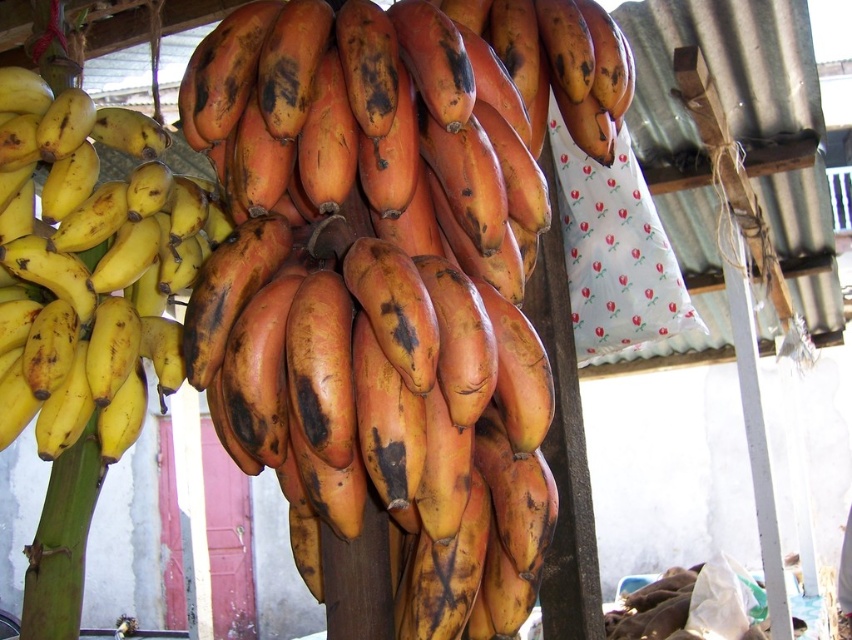
Question: Which object is farther from the camera taking this photo?

Choices:
 (A) ripe brown bananas at center
 (B) yellow matte bananas at left

Answer: (B)

Question: Does ripe brown bananas at center appear under yellow matte bananas at left?

Choices:
 (A) no
 (B) yes

Answer: (B)

Question: Considering the relative positions of ripe brown bananas at center and yellow matte bananas at left in the image provided, where is ripe brown bananas at center located with respect to yellow matte bananas at left?

Choices:
 (A) above
 (B) below

Answer: (B)

Question: Among these objects, which one is nearest to the camera?

Choices:
 (A) yellow matte bananas at left
 (B) ripe brown bananas at center

Answer: (B)

Question: Is ripe brown bananas at center above yellow matte bananas at left?

Choices:
 (A) yes
 (B) no

Answer: (B)